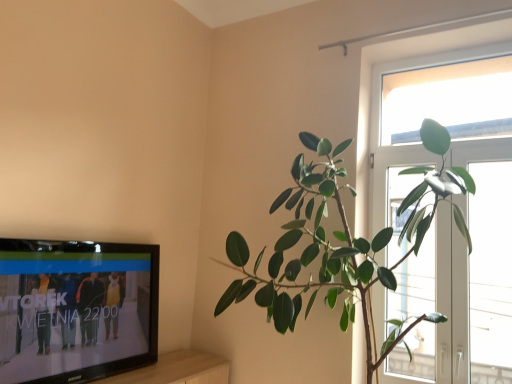
Describe the element at coordinates (408, 69) in the screenshot. I see `transparent glass window at upper right, the 1th window from the left` at that location.

Where is `transparent glass window at right, the first window from the right`? transparent glass window at right, the first window from the right is located at coordinates [x=490, y=273].

This screenshot has height=384, width=512. What do you see at coordinates (490, 273) in the screenshot?
I see `transparent glass window at right, arranged as the second window when viewed from the left` at bounding box center [490, 273].

Where is `green glossy plant at right`? This screenshot has width=512, height=384. green glossy plant at right is located at coordinates (341, 241).

This screenshot has width=512, height=384. In order to click on transparent glass window at upper right, arranged as the 2th window when viewed from the right in this screenshot , I will do `click(408, 69)`.

Considering the positions of objects transparent glass window at upper right, the 1th window from the left, and transparent glass window at right, the first window from the right, in the image provided, who is behind, transparent glass window at upper right, the 1th window from the left, or transparent glass window at right, the first window from the right,?

transparent glass window at upper right, the 1th window from the left, is more distant.

Looking at this image, between transparent glass window at upper right, the 1th window from the left, and transparent glass window at right, arranged as the second window when viewed from the left, which one appears on the left side from the viewer's perspective?

transparent glass window at upper right, the 1th window from the left, is more to the left.

From a real-world perspective, is transparent glass window at upper right, the 1th window from the left, physically above transparent glass window at right, arranged as the second window when viewed from the left?

Yes.

Is there a large distance between transparent glass window at upper right, arranged as the 2th window when viewed from the right, and transparent glass window at right, arranged as the second window when viewed from the left?

That's not correct — transparent glass window at upper right, arranged as the 2th window when viewed from the right, is a little close to transparent glass window at right, arranged as the second window when viewed from the left.

Where is `window screen located on the left of transparent glass window at right, arranged as the second window when viewed from the left`? window screen located on the left of transparent glass window at right, arranged as the second window when viewed from the left is located at coordinates (449, 100).

How different are the orientations of transparent glass window at upper right and transparent glass window at right, the first window from the right, in degrees?

The angular difference between transparent glass window at upper right and transparent glass window at right, the first window from the right, is 1.6 degrees.

Considering the sizes of objects transparent glass window at upper right and transparent glass window at right, arranged as the second window when viewed from the left, in the image provided, who is shorter, transparent glass window at upper right or transparent glass window at right, arranged as the second window when viewed from the left,?

Standing shorter between the two is transparent glass window at upper right.

Can you confirm if transparent glass window at upper right is positioned to the right of transparent glass window at right, the first window from the right?

No, transparent glass window at upper right is not to the right of transparent glass window at right, the first window from the right.

Consider the image. What's the angular difference between green glossy plant at right and transparent glass window at right, arranged as the second window when viewed from the left,'s facing directions?

The angular difference between green glossy plant at right and transparent glass window at right, arranged as the second window when viewed from the left, is 3.42 degrees.

Is transparent glass window at right, arranged as the second window when viewed from the left, completely or partially inside green glossy plant at right?

Definitely not — transparent glass window at right, arranged as the second window when viewed from the left, is not inside green glossy plant at right.

Considering the sizes of objects green glossy plant at right and transparent glass window at right, arranged as the second window when viewed from the left, in the image provided, who is taller, green glossy plant at right or transparent glass window at right, arranged as the second window when viewed from the left,?

green glossy plant at right is taller.

Is green glossy plant at right wider than transparent glass window at right, the first window from the right?

Indeed, green glossy plant at right has a greater width compared to transparent glass window at right, the first window from the right.

From the image's perspective, is green glossy plant at right over transparent glass window at upper right?

No, from the image's perspective, green glossy plant at right is not on top of transparent glass window at upper right.

Which object is closer to the camera taking this photo, green glossy plant at right or transparent glass window at upper right?

green glossy plant at right is in front.

Can you confirm if green glossy plant at right is shorter than transparent glass window at upper right?

Incorrect, the height of green glossy plant at right does not fall short of that of transparent glass window at upper right.

Based on their sizes in the image, would you say green glossy plant at right is bigger or smaller than transparent glass window at upper right?

green glossy plant at right is bigger than transparent glass window at upper right.

Does transparent glass window at right, arranged as the second window when viewed from the left, have a greater width compared to green glossy plant at right?

No, transparent glass window at right, arranged as the second window when viewed from the left, is not wider than green glossy plant at right.

Who is smaller, transparent glass window at right, the first window from the right, or green glossy plant at right?

transparent glass window at right, the first window from the right.

Is transparent glass window at right, the first window from the right, not near green glossy plant at right?

No.

How different are the orientations of transparent glass window at right, arranged as the second window when viewed from the left, and green glossy plant at right in degrees?

transparent glass window at right, arranged as the second window when viewed from the left, and green glossy plant at right are facing 3.42 degrees away from each other.

Can you confirm if transparent glass window at upper right is smaller than transparent glass window at upper right, arranged as the 2th window when viewed from the right?

Yes.

From the image's perspective, which object appears higher, transparent glass window at upper right or transparent glass window at upper right, the 1th window from the left?

transparent glass window at upper right.

Is transparent glass window at upper right, the 1th window from the left, at the back of transparent glass window at upper right?

Yes, transparent glass window at upper right, the 1th window from the left, is at the back of transparent glass window at upper right.

Is transparent glass window at upper right next to transparent glass window at upper right, arranged as the 2th window when viewed from the right?

transparent glass window at upper right is not next to transparent glass window at upper right, arranged as the 2th window when viewed from the right, and they're not touching.

Considering the positions of points (382, 50) and (330, 163), is point (382, 50) closer to camera compared to point (330, 163)?

No, it is not.

Would you say transparent glass window at upper right, arranged as the 2th window when viewed from the right, is to the left or to the right of green glossy plant at right in the picture?

Clearly, transparent glass window at upper right, arranged as the 2th window when viewed from the right, is on the right of green glossy plant at right in the image.

Considering the sizes of objects transparent glass window at upper right, arranged as the 2th window when viewed from the right, and green glossy plant at right in the image provided, who is wider, transparent glass window at upper right, arranged as the 2th window when viewed from the right, or green glossy plant at right?

Wider between the two is green glossy plant at right.

Is transparent glass window at upper right, the 1th window from the left, bigger or smaller than green glossy plant at right?

In the image, transparent glass window at upper right, the 1th window from the left, appears to be smaller than green glossy plant at right.

I want to click on window located on the left of transparent glass window at right, arranged as the second window when viewed from the left, so click(408, 69).

At what (x,y) coordinates should I click in order to perform the action: click on window screen located behind the transparent glass window at right, the first window from the right. Please return your answer as a coordinate pair (x, y). The height and width of the screenshot is (384, 512). Looking at the image, I should click on (449, 100).

From the image, which object appears to be farther from green glossy plant at right, transparent glass window at upper right or transparent glass window at upper right, the 1th window from the left?

transparent glass window at upper right lies further to green glossy plant at right than the other object.

From the image, which object appears to be farther from transparent glass window at upper right, arranged as the 2th window when viewed from the right, transparent glass window at right, arranged as the second window when viewed from the left, or green glossy plant at right?

transparent glass window at right, arranged as the second window when viewed from the left, is further to transparent glass window at upper right, arranged as the 2th window when viewed from the right.

Which object lies nearer to the anchor point green glossy plant at right, transparent glass window at upper right or transparent glass window at right, arranged as the second window when viewed from the left?

transparent glass window at right, arranged as the second window when viewed from the left.

Looking at the image, which one is located further to transparent glass window at right, the first window from the right, transparent glass window at upper right or transparent glass window at upper right, the 1th window from the left?

Based on the image, transparent glass window at upper right, the 1th window from the left, appears to be further to transparent glass window at right, the first window from the right.

Based on their spatial positions, is transparent glass window at right, arranged as the second window when viewed from the left, or transparent glass window at upper right further from green glossy plant at right?

transparent glass window at upper right lies further to green glossy plant at right than the other object.

Consider the image. Estimate the real-world distances between objects in this image. Which object is closer to transparent glass window at right, arranged as the second window when viewed from the left, transparent glass window at upper right or green glossy plant at right?

green glossy plant at right is closer to transparent glass window at right, arranged as the second window when viewed from the left.

Considering their positions, is green glossy plant at right positioned closer to transparent glass window at right, the first window from the right, than transparent glass window at upper right?

green glossy plant at right lies closer to transparent glass window at right, the first window from the right, than the other object.

Looking at the image, which one is located further to green glossy plant at right, transparent glass window at upper right, arranged as the 2th window when viewed from the right, or transparent glass window at upper right?

transparent glass window at upper right is further to green glossy plant at right.

This screenshot has height=384, width=512. Find the location of `window that lies between transparent glass window at upper right and transparent glass window at right, the first window from the right, from top to bottom`. window that lies between transparent glass window at upper right and transparent glass window at right, the first window from the right, from top to bottom is located at coordinates (408, 69).

This screenshot has height=384, width=512. I want to click on window located between green glossy plant at right and transparent glass window at right, the first window from the right, in the left-right direction, so click(x=408, y=69).

This screenshot has width=512, height=384. Identify the location of houseplant between transparent glass window at upper right and transparent glass window at right, arranged as the second window when viewed from the left, from top to bottom. (341, 241).

You are a GUI agent. You are given a task and a screenshot of the screen. Output one action in this format:
    pyautogui.click(x=<x>, y=<y>)
    Task: Click on the window between transparent glass window at upper right and green glossy plant at right vertically
    This screenshot has width=512, height=384.
    Given the screenshot: What is the action you would take?
    pyautogui.click(x=408, y=69)